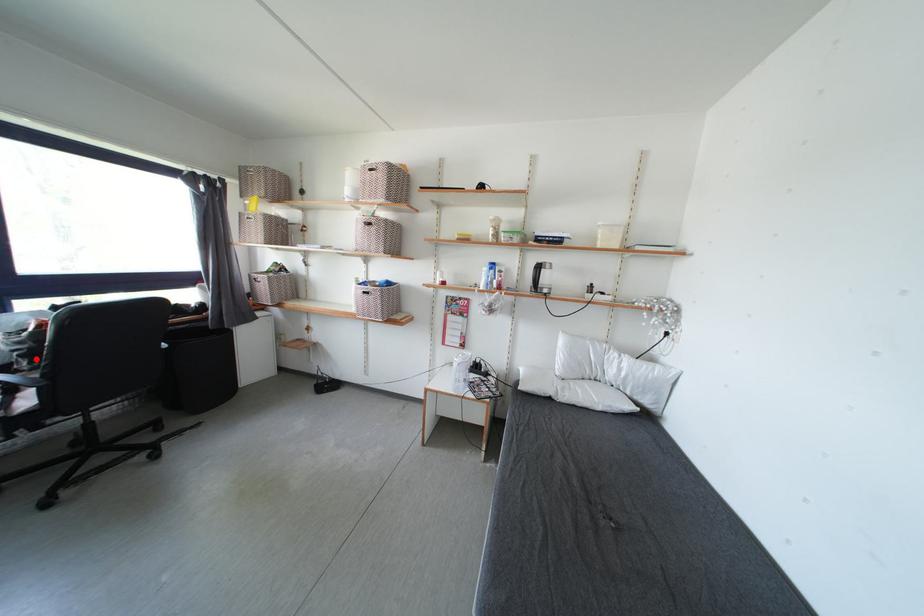
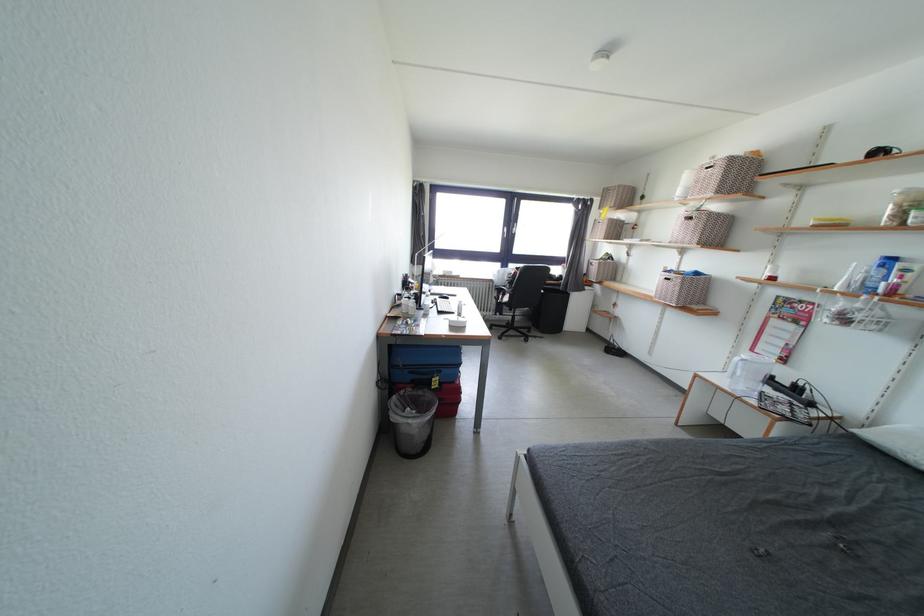
Where in the second image is the point corresponding to the highlighted location from the first image?

(517, 286)